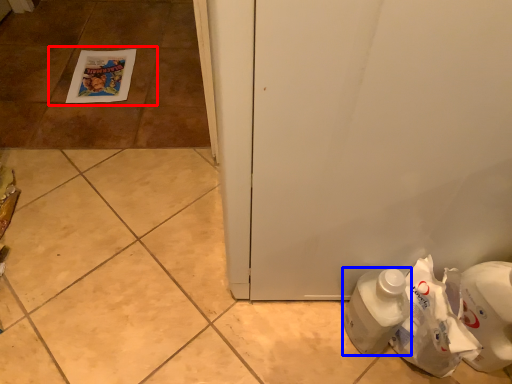
Question: Which object is closer to the camera taking this photo, tile (highlighted by a red box) or bottle (highlighted by a blue box)?

Choices:
 (A) tile
 (B) bottle

Answer: (B)